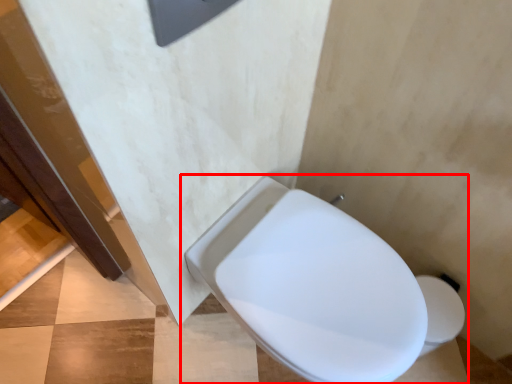
Question: From the image's perspective, where is toilet (annotated by the red box) located relative to concrete?

Choices:
 (A) below
 (B) above

Answer: (B)